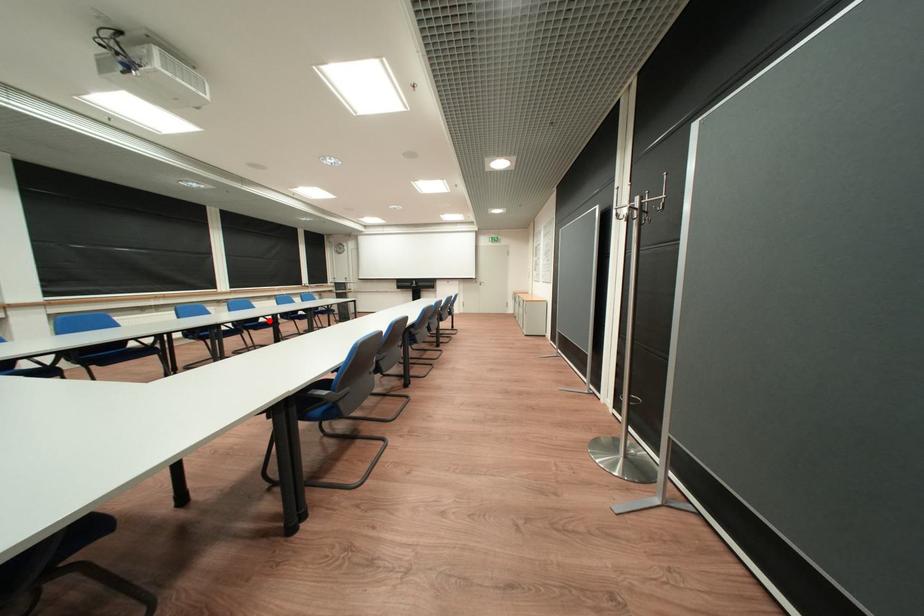
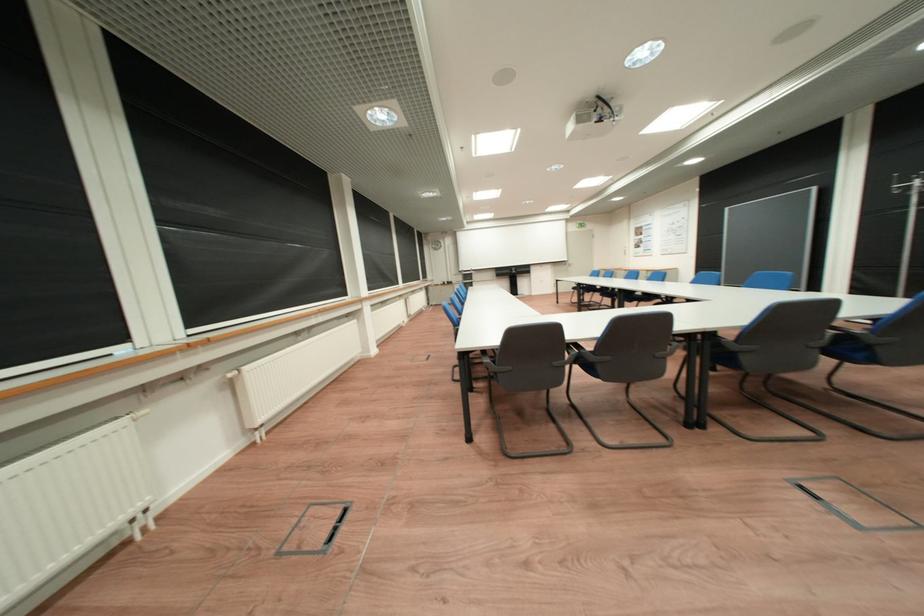
Question: I am providing you with two images of the same scene from different viewpoints. A red point is marked on the first image. Is the red point's position out of view in image 2?

Choices:
 (A) Yes
 (B) No

Answer: (A)